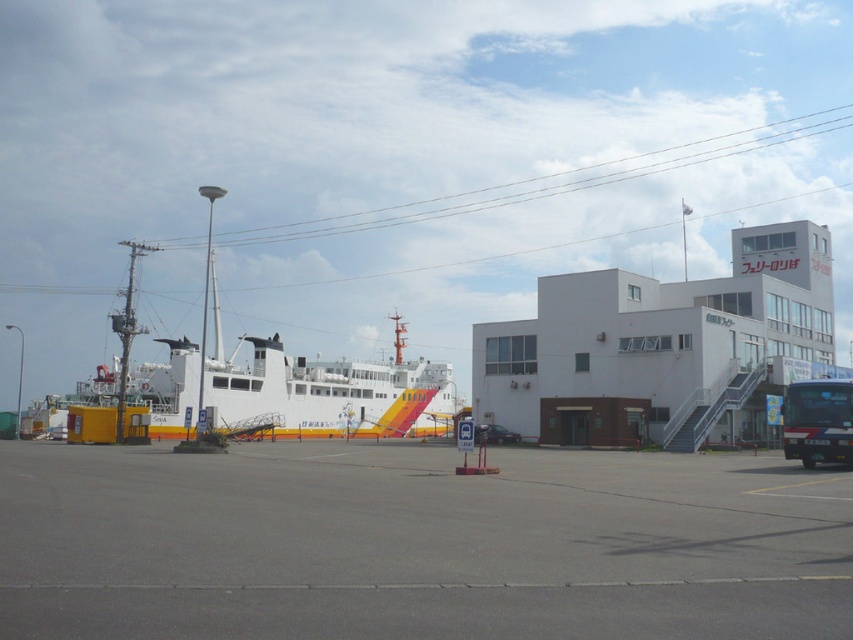
Is gray asphalt parking lot at center positioned behind green matte bus at lower right?

No, gray asphalt parking lot at center is closer to the viewer.

Does gray asphalt parking lot at center appear under green matte bus at lower right?

Indeed, gray asphalt parking lot at center is positioned under green matte bus at lower right.

Between point (236, 506) and point (843, 449), which one is positioned in front?

Point (236, 506) is in front.

Where is `gray asphalt parking lot at center`? This screenshot has height=640, width=853. gray asphalt parking lot at center is located at coordinates (418, 544).

From the picture: Is gray asphalt parking lot at center thinner than shiny black car at center?

Incorrect, gray asphalt parking lot at center's width is not less than shiny black car at center's.

Which is in front, point (374, 540) or point (506, 438)?

Point (374, 540) is in front.

Which is behind, point (836, 513) or point (486, 433)?

Positioned behind is point (486, 433).

The image size is (853, 640). What are the coordinates of `gray asphalt parking lot at center` in the screenshot? It's located at (418, 544).

Is green matte bus at lower right above shiny black car at center?

Yes.

Is point (816, 394) farther from viewer compared to point (500, 426)?

No, (816, 394) is closer to viewer.

Who is more distant from viewer, (x=788, y=410) or (x=514, y=433)?

The point (x=514, y=433) is behind.

Find the location of a particular element. Image resolution: width=853 pixels, height=640 pixels. green matte bus at lower right is located at coordinates (817, 420).